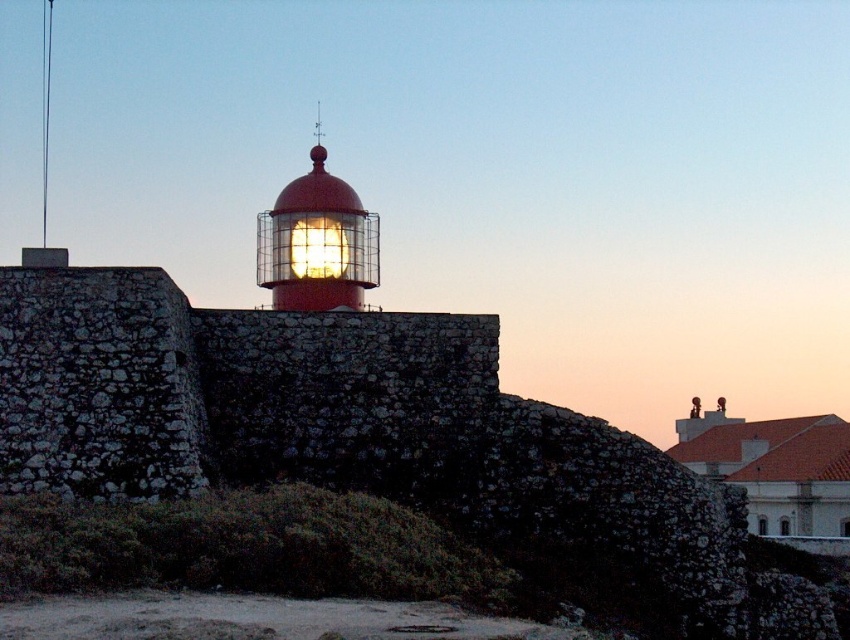
Is matte red lighthouse at center bigger than matte glass lighthouse at center?

Correct, matte red lighthouse at center is larger in size than matte glass lighthouse at center.

Between point (279, 218) and point (329, 275), which one is positioned in front?

Point (329, 275) is in front.

Identify the location of matte red lighthouse at center. The width and height of the screenshot is (850, 640). 316,243.